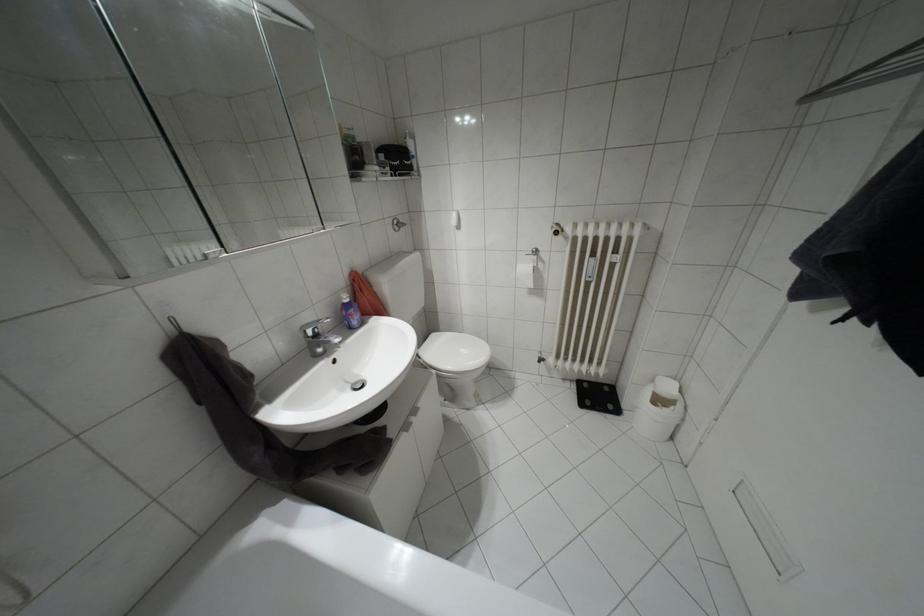
This screenshot has width=924, height=616. Find the location of `faucet handle`. faucet handle is located at coordinates (314, 323).